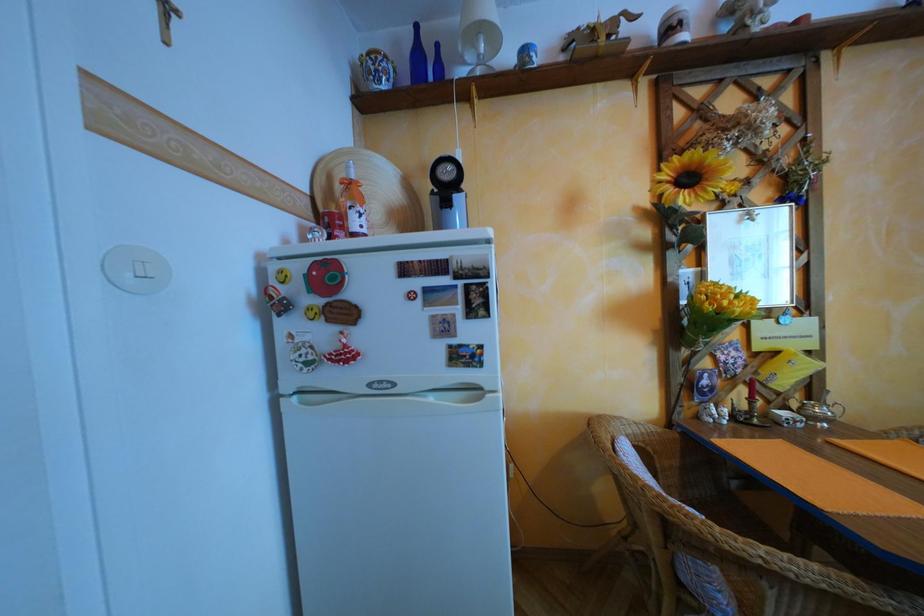
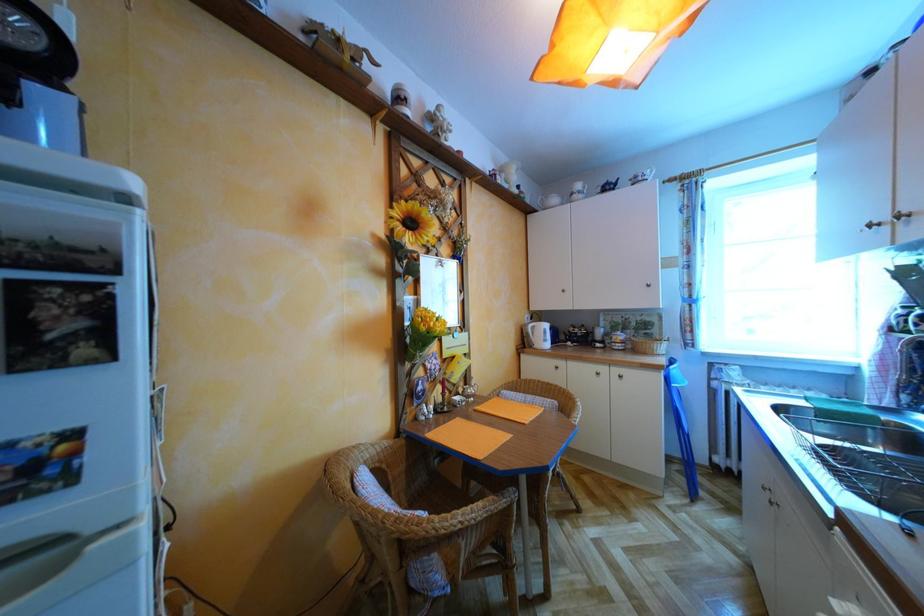
Question: The first image is from the beginning of the video and the second image is from the end. How did the camera likely rotate when shooting the video?

Choices:
 (A) Left
 (B) Right
 (C) Up
 (D) Down

Answer: (B)